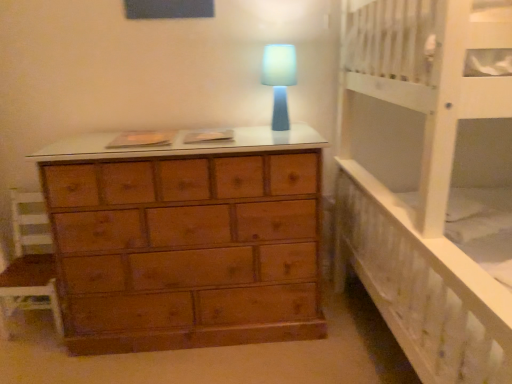
Question: Is the position of white wooden bed at right less distant than that of blue matte lamp at center?

Choices:
 (A) yes
 (B) no

Answer: (A)

Question: Does white wooden bed at right have a greater height compared to blue matte lamp at center?

Choices:
 (A) no
 (B) yes

Answer: (B)

Question: From a real-world perspective, is white wooden bed at right beneath blue matte lamp at center?

Choices:
 (A) no
 (B) yes

Answer: (B)

Question: Is white wooden bed at right touching blue matte lamp at center?

Choices:
 (A) yes
 (B) no

Answer: (B)

Question: Is white wooden bed at right oriented away from blue matte lamp at center?

Choices:
 (A) no
 (B) yes

Answer: (A)

Question: Is wooden chair at left bigger or smaller than blue matte lamp at center?

Choices:
 (A) small
 (B) big

Answer: (B)

Question: From the image's perspective, relative to blue matte lamp at center, is wooden chair at left above or below?

Choices:
 (A) below
 (B) above

Answer: (A)

Question: In the image, is wooden chair at left positioned in front of or behind blue matte lamp at center?

Choices:
 (A) front
 (B) behind

Answer: (B)

Question: From a real-world perspective, relative to blue matte lamp at center, is wooden chair at left vertically above or below?

Choices:
 (A) below
 (B) above

Answer: (A)

Question: Choose the correct answer: Is blue matte lamp at center inside white wooden bed at right or outside it?

Choices:
 (A) inside
 (B) outside

Answer: (B)

Question: From a real-world perspective, relative to white wooden bed at right, is blue matte lamp at center vertically above or below?

Choices:
 (A) below
 (B) above

Answer: (B)

Question: Looking at the image, does blue matte lamp at center seem bigger or smaller compared to white wooden bed at right?

Choices:
 (A) small
 (B) big

Answer: (A)

Question: Is blue matte lamp at center wider or thinner than white wooden bed at right?

Choices:
 (A) thin
 (B) wide

Answer: (A)

Question: Is wooden chair at left inside the boundaries of white wooden bed at right, or outside?

Choices:
 (A) outside
 (B) inside

Answer: (A)

Question: Based on their sizes in the image, would you say wooden chair at left is bigger or smaller than white wooden bed at right?

Choices:
 (A) small
 (B) big

Answer: (A)